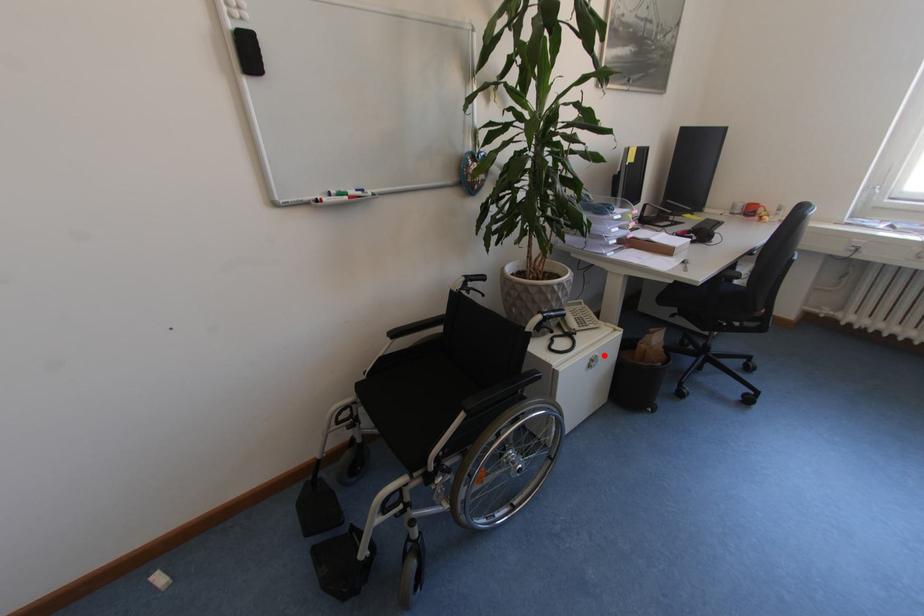
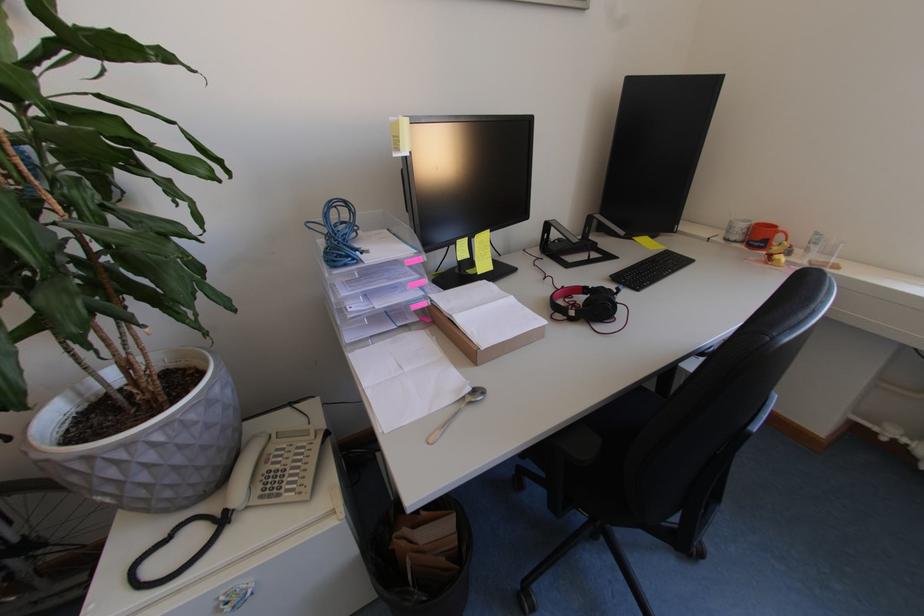
Question: I am providing you with two images of the same scene from different viewpoints. A red point is shown in image1. For the corresponding object point in image2, is it positioned nearer or farther from the camera?

Choices:
 (A) Nearer
 (B) Farther

Answer: (A)